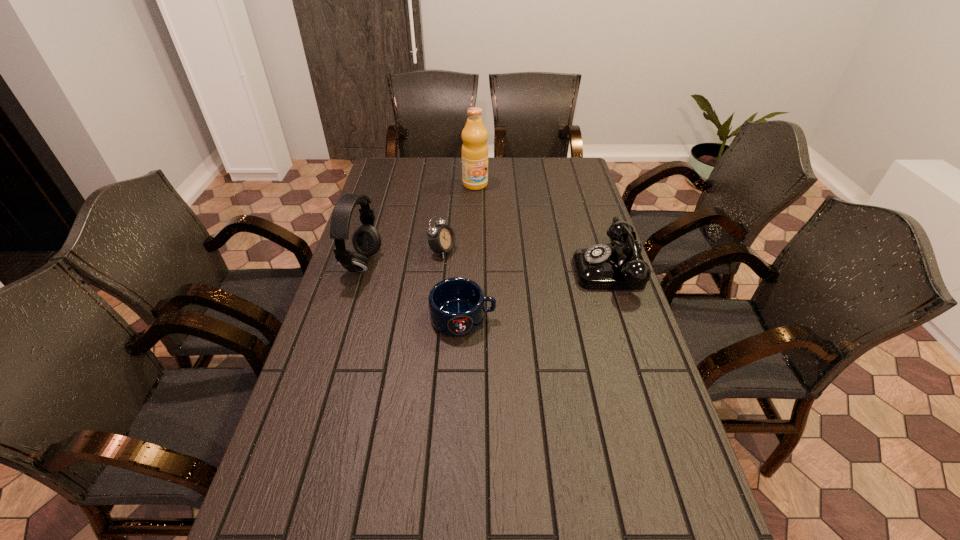
Find the location of a particular element. the shortest object is located at coordinates (457, 305).

I want to click on the rightmost object, so click(601, 267).

The height and width of the screenshot is (540, 960). Find the location of `the second tallest object`. the second tallest object is located at coordinates (366, 240).

In order to click on the leftmost object in this screenshot , I will do `click(366, 240)`.

Find the location of a particular element. alarm clock is located at coordinates (441, 238).

At what (x,y) coordinates should I click in order to perform the action: click on the farthest object. Please return your answer as a coordinate pair (x, y). This screenshot has width=960, height=540. Looking at the image, I should click on (474, 135).

Where is `fruit juice`? The image size is (960, 540). fruit juice is located at coordinates (474, 135).

The image size is (960, 540). I want to click on free region located with the handle on the side of the shortest object, so click(606, 318).

The width and height of the screenshot is (960, 540). Identify the location of free space located on the dial of the rightmost object. (x=492, y=269).

Identify the location of free location located 0.080m on the dial of the rightmost object. This screenshot has height=540, width=960. (550, 269).